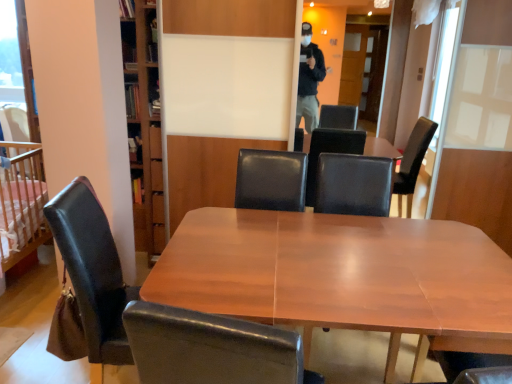
The image size is (512, 384). Describe the element at coordinates (353, 185) in the screenshot. I see `black leather armchair at center` at that location.

What do you see at coordinates (342, 276) in the screenshot? I see `wooden table at center` at bounding box center [342, 276].

What is the approximate width of black leather chair at left, positioned as the first chair in back-to-front order?

5.09 inches.

The width and height of the screenshot is (512, 384). What do you see at coordinates (67, 328) in the screenshot?
I see `leather at left, the 2th chair from the back` at bounding box center [67, 328].

Where is `black leather armchair at center`? black leather armchair at center is located at coordinates (353, 185).

The width and height of the screenshot is (512, 384). Identify the location of infant bed behind the black leather armchair at center. (21, 203).

Is black leather armchair at center at the back of wooden crib at left?

No, wooden crib at left's orientation is not away from black leather armchair at center.

Which object is closer to the camera, wooden crib at left or black leather armchair at center?

black leather armchair at center is more forward.

Which object is positioned more to the left, wooden crib at left or black leather armchair at center?

Positioned to the left is wooden crib at left.

Is wooden crib at left shorter than leather at left, the 2th chair from the back?

In fact, wooden crib at left may be taller than leather at left, the 2th chair from the back.

Are wooden crib at left and leather at left, which is counted as the first chair, starting from the front, located far from each other?

Yes.

Between wooden crib at left and leather at left, the 2th chair from the back, which one has smaller size?

leather at left, the 2th chair from the back, is smaller.

Is wooden crib at left surrounding leather at left, marked as the second chair in a left-to-right arrangement?

Definitely not — leather at left, marked as the second chair in a left-to-right arrangement, is not inside wooden crib at left.

Which is behind, point (352, 193) or point (31, 224)?

The point (31, 224) is behind.

Does black leather armchair at center have a smaller size compared to wooden crib at left?

Yes.

Considering the relative positions of black leather armchair at center and wooden crib at left in the image provided, is black leather armchair at center to the left of wooden crib at left from the viewer's perspective?

No.

Which is behind, black leather armchair at center or wooden crib at left?

Positioned behind is wooden crib at left.

In terms of width, does wooden table at center look wider or thinner when compared to black leather armchair at center?

wooden table at center is wider than black leather armchair at center.

Is wooden table at center directly adjacent to black leather armchair at center?

No, wooden table at center is not making contact with black leather armchair at center.

Is wooden table at center to the right of black leather armchair at center from the viewer's perspective?

Incorrect, wooden table at center is not on the right side of black leather armchair at center.

From a real-world perspective, is wooden table at center positioned under black leather armchair at center based on gravity?

Yes, from a real-world perspective, wooden table at center is below black leather armchair at center.

From the picture: Is black leather armchair at center positioned with its back to leather at left, the 2th chair from the back?

No, leather at left, the 2th chair from the back, is not at the back of black leather armchair at center.

Which of these two, black leather armchair at center or leather at left, the 1th chair when ordered from right to left, is wider?

Wider between the two is leather at left, the 1th chair when ordered from right to left.

Where is `armchair on the right of leather at left, which is counted as the first chair, starting from the front`? armchair on the right of leather at left, which is counted as the first chair, starting from the front is located at coordinates (353, 185).

Can you confirm if black leather armchair at center is bigger than leather at left, the 2th chair from the back?

Actually, black leather armchair at center might be smaller than leather at left, the 2th chair from the back.

Starting from the black leather armchair at center, which chair is the 1st one in front? Please provide its 2D coordinates.

[(92, 271)]

Can you tell me how much black leather chair at left, positioned as the first chair in back-to-front order, and black leather armchair at center differ in facing direction?

There is a 123-degree angle between the facing directions of black leather chair at left, positioned as the first chair in back-to-front order, and black leather armchair at center.

From a real-world perspective, is black leather chair at left, which is the 2th chair from front to back, positioned over black leather armchair at center based on gravity?

Actually, black leather chair at left, which is the 2th chair from front to back, is physically below black leather armchair at center in the real world.

Based on the photo, from the image's perspective, is wooden table at center on top of wooden crib at left?

No.

Looking at this image, is wooden table at center far from wooden crib at left?

Yes, wooden table at center is far from wooden crib at left.

Would you say wooden table at center is inside or outside wooden crib at left?

wooden table at center lies outside wooden crib at left.

Where is `infant bed below the black leather armchair at center (from a real-world perspective)`? infant bed below the black leather armchair at center (from a real-world perspective) is located at coordinates (21, 203).

Find the location of `chair that is the 2nd object to the right of the wooden crib at left, starting at the anchor`. chair that is the 2nd object to the right of the wooden crib at left, starting at the anchor is located at coordinates (67, 328).

Which object lies nearer to the anchor point leather at left, the 1th chair when ordered from right to left, black leather chair at left, positioned as the first chair in back-to-front order, or black leather armchair at center?

Based on the image, black leather chair at left, positioned as the first chair in back-to-front order, appears to be nearer to leather at left, the 1th chair when ordered from right to left.

Based on the photo, estimate the real-world distances between objects in this image. Which object is further from wooden table at center, wooden crib at left or black leather chair at left, the second chair from the right?

wooden crib at left lies further to wooden table at center than the other object.

Looking at the image, which one is located closer to wooden crib at left, black leather armchair at center or wooden table at center?

wooden table at center lies closer to wooden crib at left than the other object.

Based on the photo, based on their spatial positions, is black leather armchair at center or wooden table at center closer to black leather chair at left, which is counted as the 1th chair, starting from the left?

Based on the image, wooden table at center appears to be nearer to black leather chair at left, which is counted as the 1th chair, starting from the left.

Which object lies further to the anchor point leather at left, which is counted as the first chair, starting from the front, black leather chair at left, which is the 2th chair from front to back, or wooden table at center?

wooden table at center.

Which object lies nearer to the anchor point black leather armchair at center, leather at left, the 1th chair when ordered from right to left, or wooden crib at left?

leather at left, the 1th chair when ordered from right to left, is closer to black leather armchair at center.

Which object lies further to the anchor point wooden table at center, wooden crib at left or black leather armchair at center?

wooden crib at left lies further to wooden table at center than the other object.

Looking at the image, which one is located further to black leather armchair at center, wooden crib at left or wooden table at center?

The object further to black leather armchair at center is wooden crib at left.

This screenshot has width=512, height=384. I want to click on desk located between wooden crib at left and black leather armchair at center in the left-right direction, so click(342, 276).

You are a GUI agent. You are given a task and a screenshot of the screen. Output one action in this format:
    pyautogui.click(x=<x>, y=<y>)
    Task: Click on the desk located between black leather chair at left, the second chair from the right, and black leather armchair at center in the left-right direction
    
    Given the screenshot: What is the action you would take?
    pyautogui.click(x=342, y=276)

Locate an element on the screen. This screenshot has height=384, width=512. chair situated between black leather chair at left, positioned as the first chair in back-to-front order, and wooden table at center from left to right is located at coordinates (67, 328).

You are a GUI agent. You are given a task and a screenshot of the screen. Output one action in this format:
    pyautogui.click(x=<x>, y=<y>)
    Task: Click on the desk between leather at left, which is counted as the first chair, starting from the front, and black leather armchair at center in the front-back direction
    
    Given the screenshot: What is the action you would take?
    pyautogui.click(x=342, y=276)